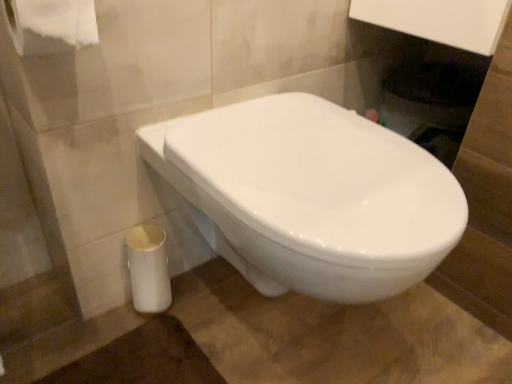
Question: Looking at the image, does white glossy trash can at lower left seem bigger or smaller compared to white paper at upper left?

Choices:
 (A) big
 (B) small

Answer: (B)

Question: Which is correct: white glossy trash can at lower left is inside white paper at upper left, or outside of it?

Choices:
 (A) inside
 (B) outside

Answer: (B)

Question: Based on their relative distances, which object is nearer to the white paper at upper left?

Choices:
 (A) white glossy toilet at center
 (B) white glossy trash can at lower left

Answer: (A)

Question: Estimate the real-world distances between objects in this image. Which object is farther from the white paper at upper left?

Choices:
 (A) white glossy toilet at center
 (B) white glossy trash can at lower left

Answer: (B)